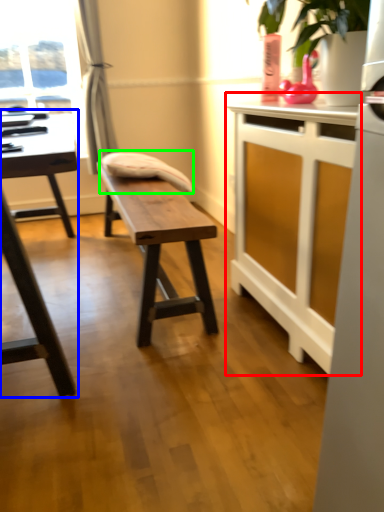
Question: Estimate the real-world distances between objects in this image. Which object is closer to table (highlighted by a red box), table (highlighted by a blue box) or swivel chair (highlighted by a green box)?

Choices:
 (A) table
 (B) swivel chair

Answer: (B)